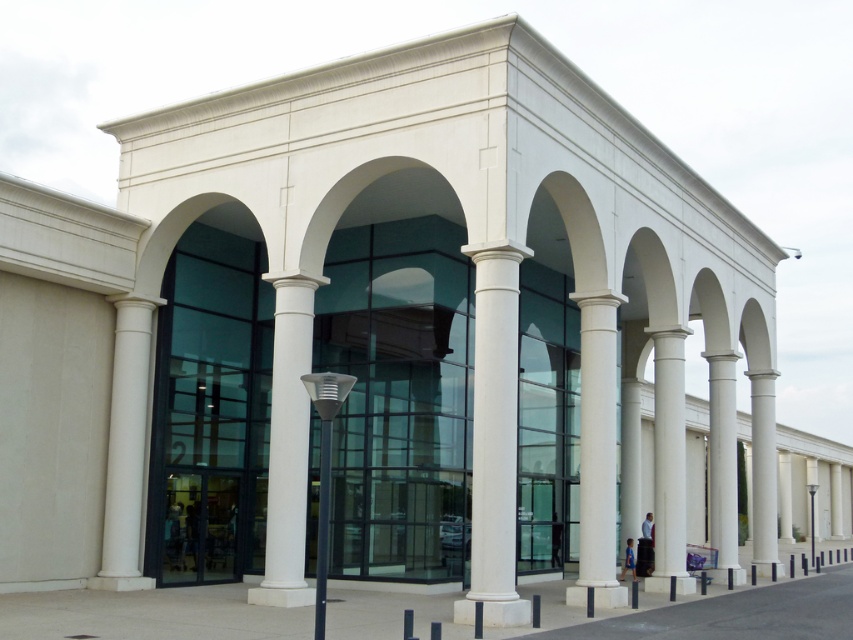
Question: Which of the following is the farthest from the observer?

Choices:
 (A) white smooth column at center
 (B) white marble column at center
 (C) white smooth column at left

Answer: (C)

Question: Estimate the real-world distances between objects in this image. Which object is closer to the white smooth column at left?

Choices:
 (A) white marble column at center
 (B) slate gray concrete pavement at center

Answer: (B)

Question: Can you confirm if slate gray concrete pavement at center is positioned above white smooth column at center?

Choices:
 (A) no
 (B) yes

Answer: (A)

Question: Observing the image, what is the correct spatial positioning of slate gray concrete pavement at center in reference to white marble column at center?

Choices:
 (A) below
 (B) above

Answer: (A)

Question: Which object is positioned farthest from the slate gray concrete pavement at center?

Choices:
 (A) white smooth column at left
 (B) white marble column at center

Answer: (B)

Question: Is white smooth column at center further to camera compared to white smooth column at left?

Choices:
 (A) no
 (B) yes

Answer: (A)